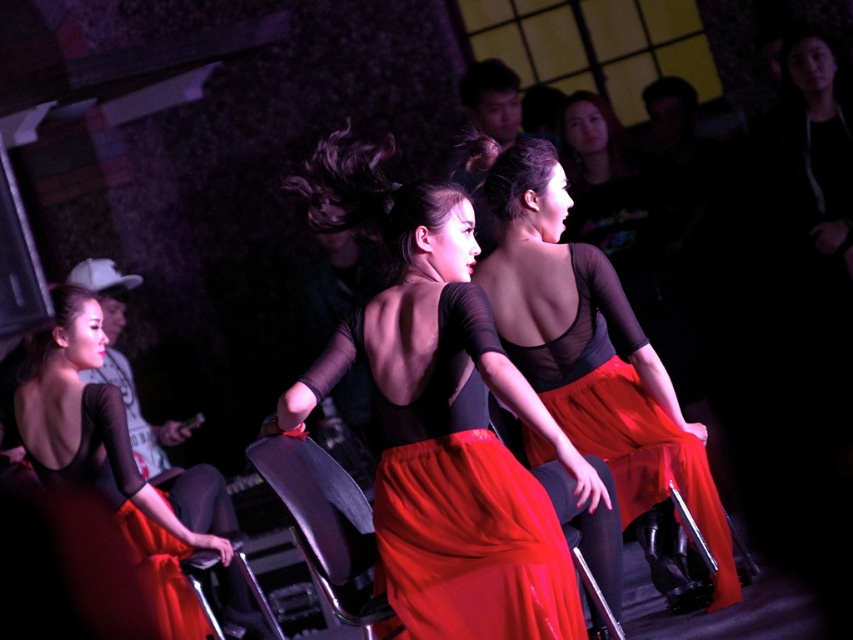
Question: Which point is farther from the camera taking this photo?

Choices:
 (A) (281, 435)
 (B) (526, 392)
 (C) (84, 452)
 (D) (672, 413)

Answer: (D)

Question: Which point is closer to the camera?

Choices:
 (A) (323, 452)
 (B) (154, 520)
 (C) (440, 545)
 (D) (621, 298)

Answer: (C)

Question: Can you confirm if matte black top at center is wider than matte black chair at center?

Choices:
 (A) yes
 (B) no

Answer: (A)

Question: Which of the following is the closest to the observer?

Choices:
 (A) matte black dress at center
 (B) matte black top at center

Answer: (A)

Question: Can you confirm if matte black leotard at center is wider than matte black chair at center?

Choices:
 (A) no
 (B) yes

Answer: (B)

Question: Considering the relative positions of matte black top at center and matte black dress at center in the image provided, where is matte black top at center located with respect to matte black dress at center?

Choices:
 (A) below
 (B) above

Answer: (B)